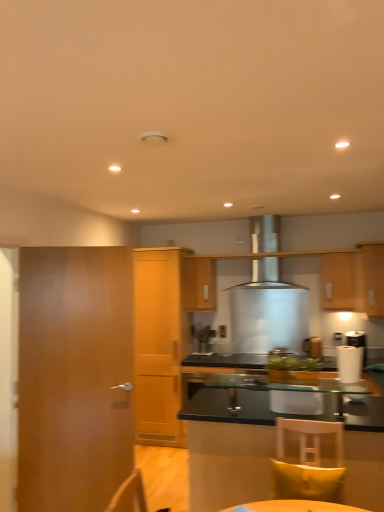
Question: From a real-world perspective, does wooden door at left stand above satin silver coffee machine at center?

Choices:
 (A) yes
 (B) no

Answer: (A)

Question: From the image's perspective, is wooden door at left on top of satin silver coffee machine at center?

Choices:
 (A) yes
 (B) no

Answer: (A)

Question: From a real-world perspective, is wooden door at left below satin silver coffee machine at center?

Choices:
 (A) no
 (B) yes

Answer: (A)

Question: Is wooden door at left outside satin silver coffee machine at center?

Choices:
 (A) yes
 (B) no

Answer: (A)

Question: Is wooden door at left to the right of satin silver coffee machine at center from the viewer's perspective?

Choices:
 (A) no
 (B) yes

Answer: (A)

Question: Is wooden door at left positioned far away from satin silver coffee machine at center?

Choices:
 (A) yes
 (B) no

Answer: (A)

Question: Is satin silver range hood at center at the right side of wooden cabinet at right, the 4th cabinetry viewed from the back?

Choices:
 (A) yes
 (B) no

Answer: (B)

Question: Is satin silver range hood at center bigger than wooden cabinet at right, the second cabinetry in the front-to-back sequence?

Choices:
 (A) no
 (B) yes

Answer: (B)

Question: Is satin silver range hood at center positioned with its back to wooden cabinet at right, the 4th cabinetry viewed from the back?

Choices:
 (A) yes
 (B) no

Answer: (B)

Question: Does satin silver range hood at center have a smaller size compared to wooden cabinet at right, the 4th cabinetry viewed from the back?

Choices:
 (A) no
 (B) yes

Answer: (A)

Question: Is satin silver range hood at center in front of wooden cabinet at right, the 4th cabinetry viewed from the back?

Choices:
 (A) yes
 (B) no

Answer: (B)

Question: Can you confirm if satin silver range hood at center is wider than wooden cabinet at right, the second cabinetry in the front-to-back sequence?

Choices:
 (A) no
 (B) yes

Answer: (B)

Question: Can we say yellow fabric pillow at lower right lies outside wooden door at left?

Choices:
 (A) yes
 (B) no

Answer: (A)